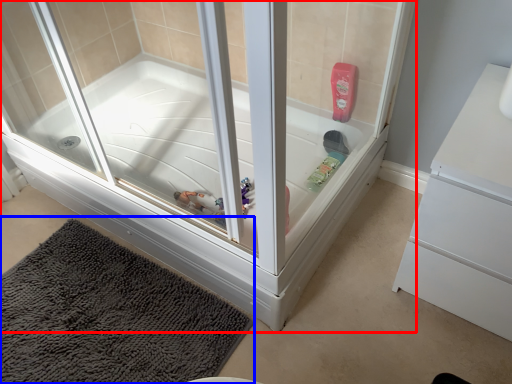
Question: Which object appears farthest to the camera in this image, bathtub (highlighted by a red box) or bath mat (highlighted by a blue box)?

Choices:
 (A) bathtub
 (B) bath mat

Answer: (B)